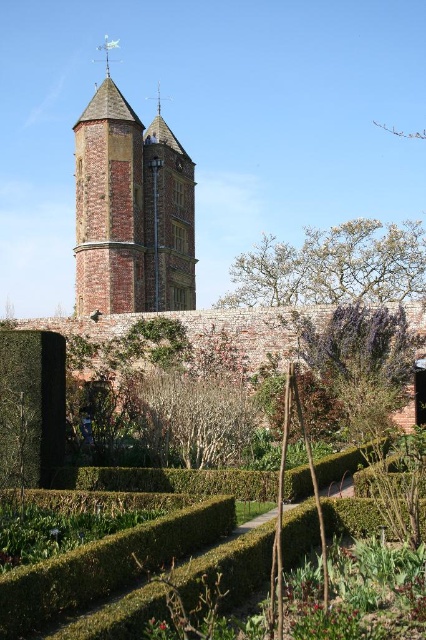
Does brick stone bell tower at upper center have a larger size compared to green leafy bush at center?

Yes, brick stone bell tower at upper center is bigger than green leafy bush at center.

Looking at this image, can you confirm if brick stone bell tower at upper center is smaller than green leafy bush at center?

Actually, brick stone bell tower at upper center might be larger than green leafy bush at center.

Image resolution: width=426 pixels, height=640 pixels. What do you see at coordinates (131, 209) in the screenshot?
I see `brick stone bell tower at upper center` at bounding box center [131, 209].

You are a GUI agent. You are given a task and a screenshot of the screen. Output one action in this format:
    pyautogui.click(x=<x>, y=<y>)
    Task: Click on the brick stone bell tower at upper center
    
    Given the screenshot: What is the action you would take?
    pyautogui.click(x=131, y=209)

Can you confirm if brick stone bell tower at upper center is positioned below bare wood bush at center?

Actually, brick stone bell tower at upper center is above bare wood bush at center.

Between brick stone bell tower at upper center and bare wood bush at center, which one appears on the right side from the viewer's perspective?

From the viewer's perspective, bare wood bush at center appears more on the right side.

Is point (158, 268) less distant than point (192, 429)?

No, (158, 268) is behind (192, 429).

Where is `brick stone bell tower at upper center`? brick stone bell tower at upper center is located at coordinates (131, 209).

Can you confirm if bare wood bush at center is positioned below green leafy bush at center?

No.

Is point (222, 432) positioned in front of point (322, 392)?

That is True.

Image resolution: width=426 pixels, height=640 pixels. What are the coordinates of `bare wood bush at center` in the screenshot? It's located at (189, 417).